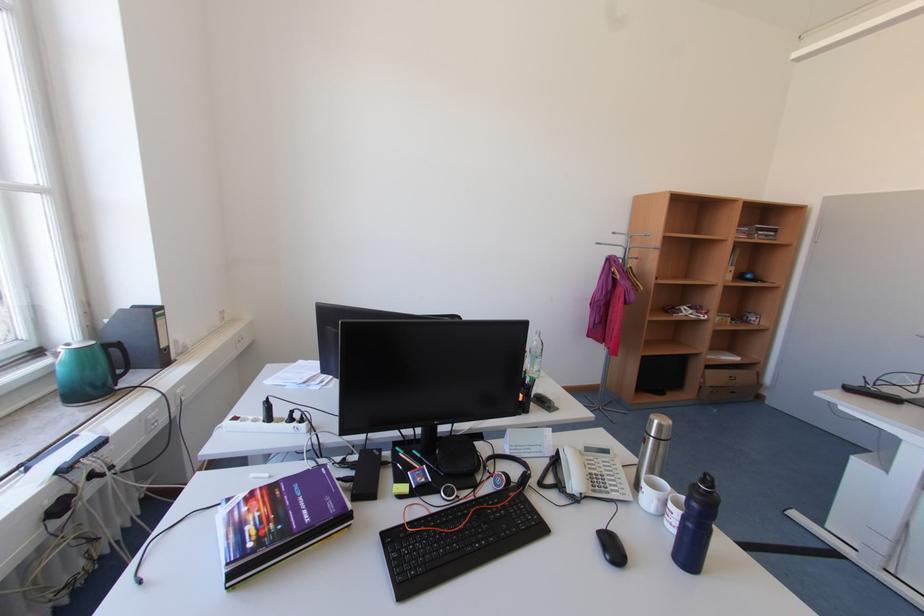
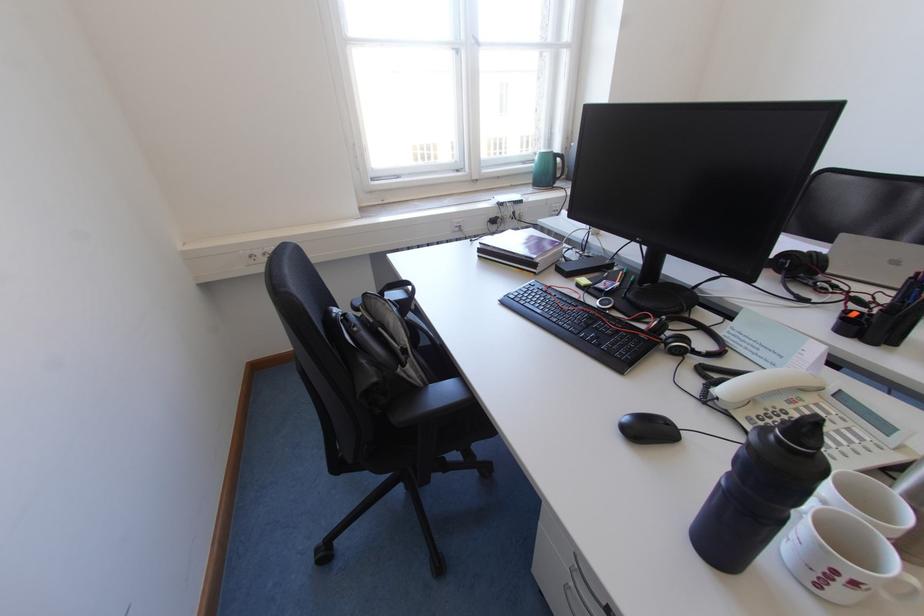
Locate, in the second image, the point that corresponds to the point at 122,352 in the first image.

(566, 161)